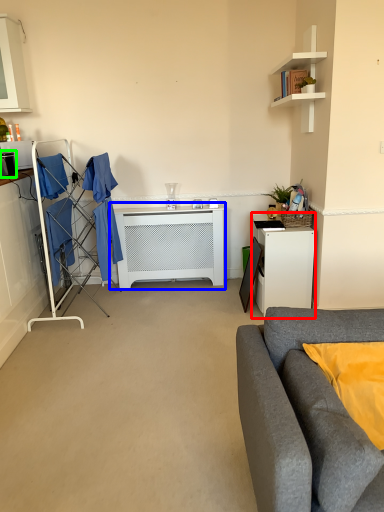
Question: Considering the real-world distances, which object is farthest from desk (highlighted by a red box)? table (highlighted by a blue box) or appliance (highlighted by a green box)?

Choices:
 (A) table
 (B) appliance

Answer: (B)